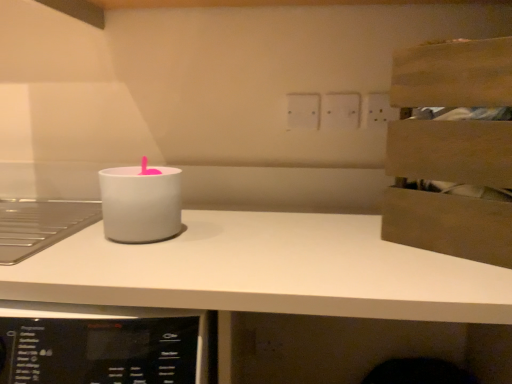
Question: Does white matte candle holder at center have a smaller size compared to wooden crate at upper right?

Choices:
 (A) no
 (B) yes

Answer: (B)

Question: From the image's perspective, would you say white matte candle holder at center is shown under wooden crate at upper right?

Choices:
 (A) no
 (B) yes

Answer: (B)

Question: Is white matte candle holder at center wider than wooden crate at upper right?

Choices:
 (A) no
 (B) yes

Answer: (A)

Question: Can we say white matte candle holder at center lies outside wooden crate at upper right?

Choices:
 (A) no
 (B) yes

Answer: (B)

Question: Is white matte candle holder at center facing towards wooden crate at upper right?

Choices:
 (A) no
 (B) yes

Answer: (A)

Question: Considering the positions of white plastic electric outlet at upper center, positioned as the 1th electric outlet in left-to-right order, and white plastic electric outlet at upper center, the 2th electric outlet when ordered from left to right, in the image, is white plastic electric outlet at upper center, positioned as the 1th electric outlet in left-to-right order, taller or shorter than white plastic electric outlet at upper center, the 2th electric outlet when ordered from left to right,?

Choices:
 (A) tall
 (B) short

Answer: (A)

Question: Is white plastic electric outlet at upper center, positioned as the 1th electric outlet in left-to-right order, situated inside white plastic electric outlet at upper center, the first electric outlet viewed from the right, or outside?

Choices:
 (A) outside
 (B) inside

Answer: (A)

Question: From a real-world perspective, is white plastic electric outlet at upper center, positioned as the 1th electric outlet in left-to-right order, positioned above or below white plastic electric outlet at upper center, the 2th electric outlet when ordered from left to right?

Choices:
 (A) below
 (B) above

Answer: (A)

Question: Does point (316, 102) appear closer or farther from the camera than point (335, 94)?

Choices:
 (A) farther
 (B) closer

Answer: (A)

Question: Is white matte candle holder at center taller or shorter than white plastic electric outlet at upper center, the first electric outlet viewed from the right?

Choices:
 (A) tall
 (B) short

Answer: (A)

Question: Relative to white plastic electric outlet at upper center, the 2th electric outlet when ordered from left to right, is white matte candle holder at center in front or behind?

Choices:
 (A) front
 (B) behind

Answer: (A)

Question: Is white matte candle holder at center to the left or to the right of white plastic electric outlet at upper center, the first electric outlet viewed from the right, in the image?

Choices:
 (A) right
 (B) left

Answer: (B)

Question: From a real-world perspective, is white matte candle holder at center above or below white plastic electric outlet at upper center, the 2th electric outlet when ordered from left to right?

Choices:
 (A) above
 (B) below

Answer: (B)

Question: Considering the positions of white matte countertop at center and white plastic electric outlet at upper center, positioned as the 1th electric outlet in left-to-right order, in the image, is white matte countertop at center wider or thinner than white plastic electric outlet at upper center, positioned as the 1th electric outlet in left-to-right order,?

Choices:
 (A) wide
 (B) thin

Answer: (A)

Question: Is white matte countertop at center inside the boundaries of white plastic electric outlet at upper center, positioned as the 1th electric outlet in left-to-right order, or outside?

Choices:
 (A) inside
 (B) outside

Answer: (B)